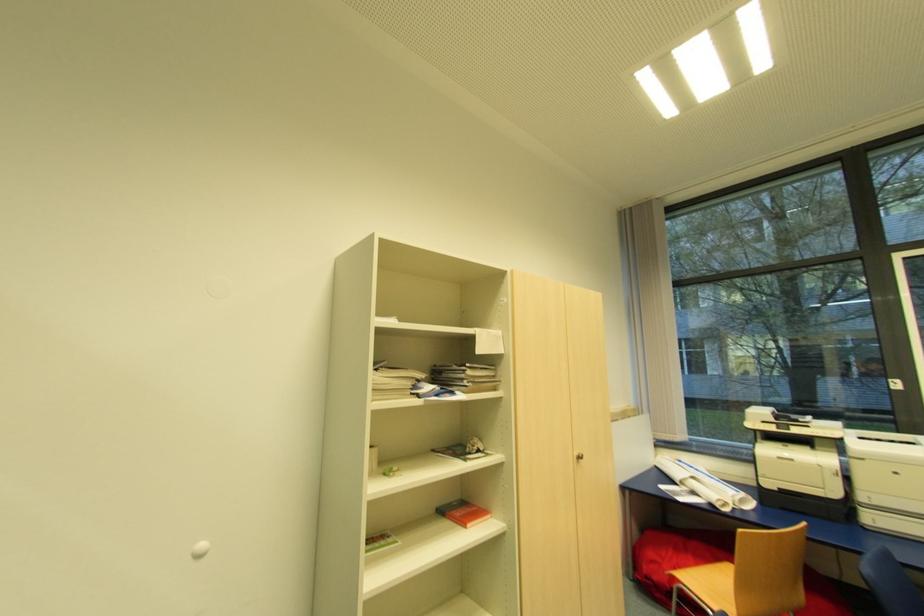
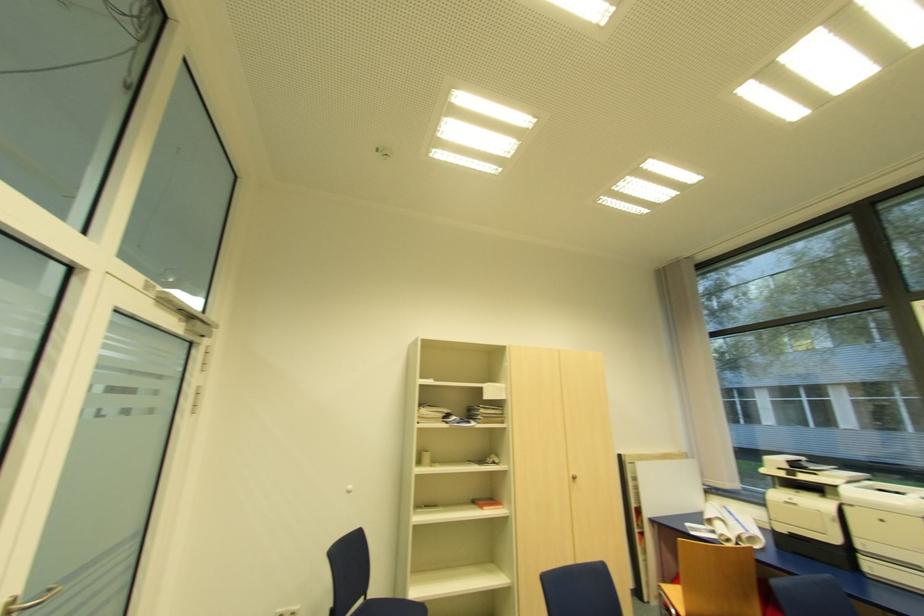
The point at (581,458) is marked in the first image. Where is the corresponding point in the second image?

(576, 477)